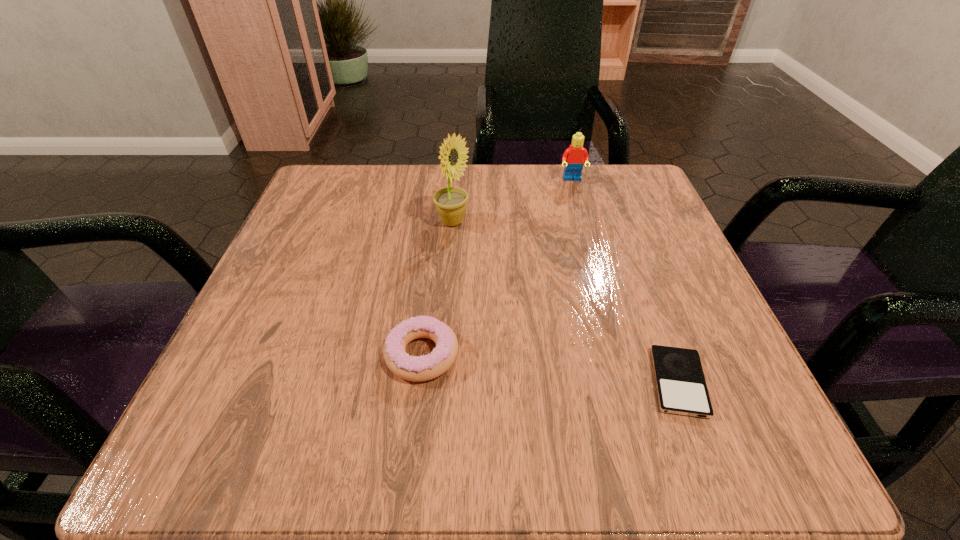
The width and height of the screenshot is (960, 540). What are the coordinates of `sunflower` in the screenshot? It's located at (451, 202).

Where is `the third nearest object`? This screenshot has height=540, width=960. the third nearest object is located at coordinates (451, 202).

The width and height of the screenshot is (960, 540). I want to click on the third shortest object, so click(x=574, y=156).

Find the location of a particular element. Image resolution: width=960 pixels, height=540 pixels. the farthest object is located at coordinates (574, 156).

I want to click on the second shortest object, so click(412, 368).

The height and width of the screenshot is (540, 960). I want to click on iPod, so click(x=681, y=388).

Identify the location of vacant space located 0.220m on the face of the sunflower. The height and width of the screenshot is (540, 960). (583, 222).

This screenshot has width=960, height=540. I want to click on free region located 0.150m on the face of the farthest object, so click(x=585, y=225).

Find the location of a particular element. The height and width of the screenshot is (540, 960). blank area located 0.400m on the back of the doughnut is located at coordinates (442, 184).

Locate an element on the screen. vacant space located on the back of the iPod is located at coordinates (617, 218).